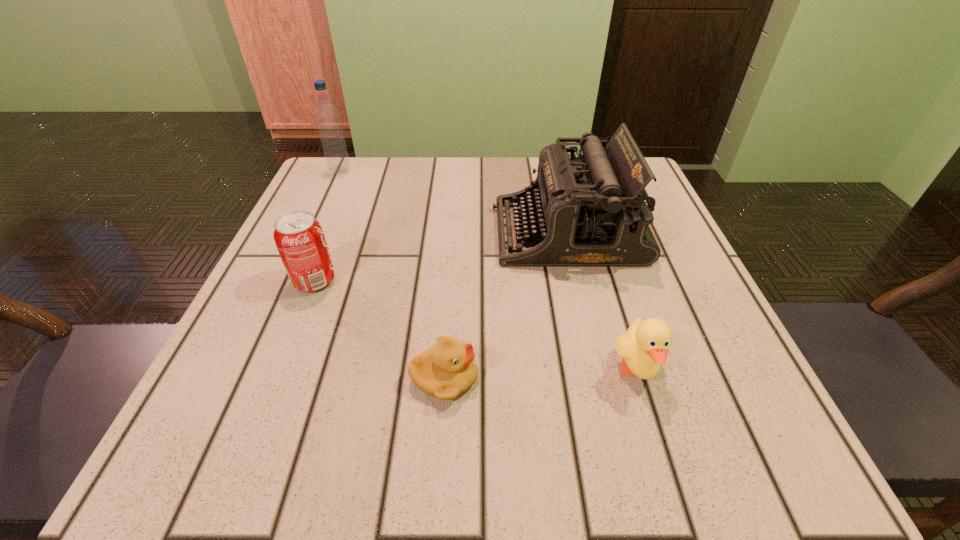
Image resolution: width=960 pixels, height=540 pixels. What are the coordinates of `free region located on the keyboard of the typewriter` in the screenshot? It's located at (413, 232).

Locate an element on the screen. The image size is (960, 540). vacant area situated 0.390m on the right of the soda is located at coordinates (559, 281).

This screenshot has width=960, height=540. Identify the location of vacant space situated 0.060m on the front-facing side of the right duckling. (660, 443).

Locate an element on the screen. Image resolution: width=960 pixels, height=540 pixels. free region located at the beak of the shortest object is located at coordinates (584, 378).

Identify the location of water bottle that is at the far edge. (327, 116).

You are a GUI agent. You are given a task and a screenshot of the screen. Output one action in this format:
    pyautogui.click(x=<x>, y=<y>)
    Task: Click on the typewriter present at the far edge
    This screenshot has height=540, width=960.
    Given the screenshot: What is the action you would take?
    pyautogui.click(x=589, y=211)

Locate an element on the screen. This screenshot has height=540, width=960. object situated at the near edge is located at coordinates (447, 369).

The image size is (960, 540). What are the coordinates of `water bottle located in the left edge section of the desktop` in the screenshot? It's located at (327, 116).

This screenshot has width=960, height=540. Find the location of `soda positioned at the left edge`. soda positioned at the left edge is located at coordinates (300, 240).

Where is `typewriter that is positioned at the right edge`? This screenshot has height=540, width=960. typewriter that is positioned at the right edge is located at coordinates (589, 211).